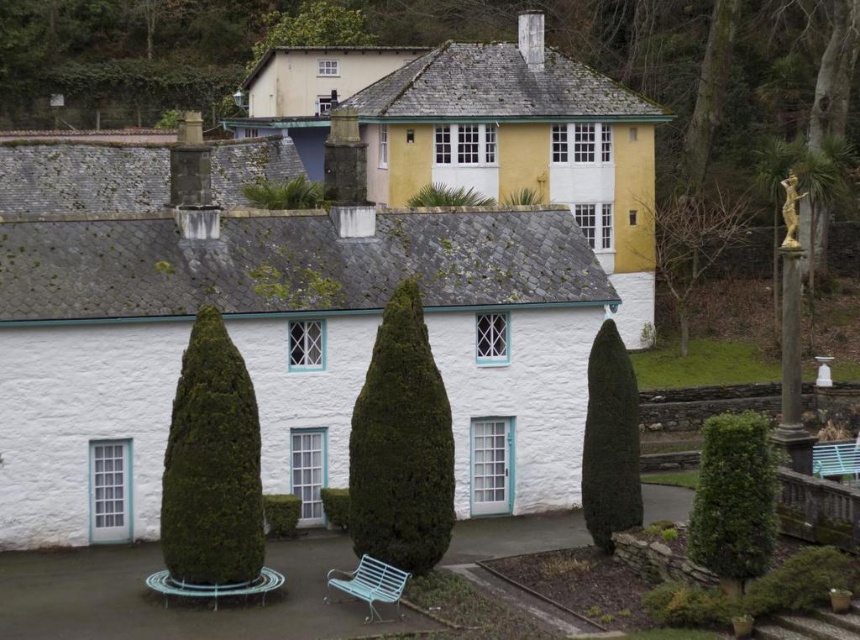
Question: Can you confirm if bare branches at right is wider than green metal bench at right?

Choices:
 (A) no
 (B) yes

Answer: (B)

Question: Observing the image, what is the correct spatial positioning of white stucco cottage at center in reference to green mossy hedge at center?

Choices:
 (A) left
 (B) right

Answer: (A)

Question: Which object is the closest to the green metal bench at right?

Choices:
 (A) green leafy hedge at right
 (B) green mossy hedge at center
 (C) bare branches at right

Answer: (A)

Question: Which object is closer to the camera taking this photo?

Choices:
 (A) dark green textured hedge at right
 (B) green metal bench at right
 (C) green leafy hedge at right
 (D) green textured hedge at center

Answer: (C)

Question: Is white stucco cottage at center in front of bare branches at right?

Choices:
 (A) no
 (B) yes

Answer: (B)

Question: Based on their relative distances, which object is nearer to the green mossy hedge at center?

Choices:
 (A) green leafy hedge at right
 (B) bare branches at right

Answer: (A)